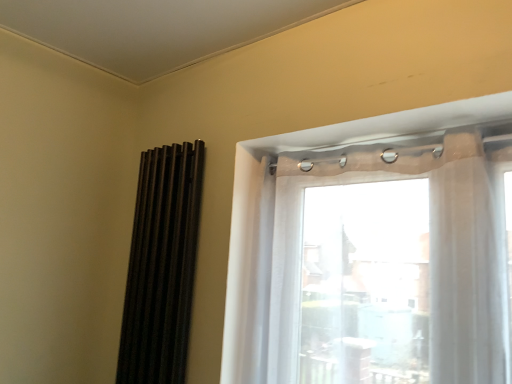
Question: Looking at their shapes, would you say black matte shutters at left is wider or thinner than translucent fabric at upper right?

Choices:
 (A) wide
 (B) thin

Answer: (B)

Question: Considering the positions of black matte shutters at left and translucent fabric at upper right in the image, is black matte shutters at left bigger or smaller than translucent fabric at upper right?

Choices:
 (A) big
 (B) small

Answer: (B)

Question: From a real-world perspective, relative to translucent fabric at upper right, is black matte shutters at left vertically above or below?

Choices:
 (A) above
 (B) below

Answer: (B)

Question: Is translucent fabric at upper right wider or thinner than black matte shutters at left?

Choices:
 (A) wide
 (B) thin

Answer: (A)

Question: Relative to black matte shutters at left, is translucent fabric at upper right in front or behind?

Choices:
 (A) behind
 (B) front

Answer: (B)

Question: From a real-world perspective, relative to black matte shutters at left, is translucent fabric at upper right vertically above or below?

Choices:
 (A) above
 (B) below

Answer: (A)

Question: Considering the relative positions of translucent fabric at upper right and black matte shutters at left in the image provided, is translucent fabric at upper right to the left or to the right of black matte shutters at left?

Choices:
 (A) left
 (B) right

Answer: (B)